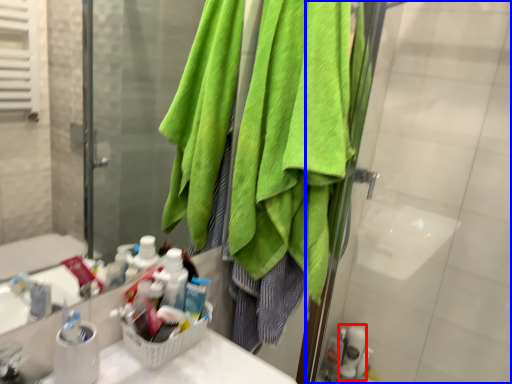
Question: Which object is further to the camera taking this photo, toiletry (highlighted by a red box) or screen door (highlighted by a blue box)?

Choices:
 (A) toiletry
 (B) screen door

Answer: (A)